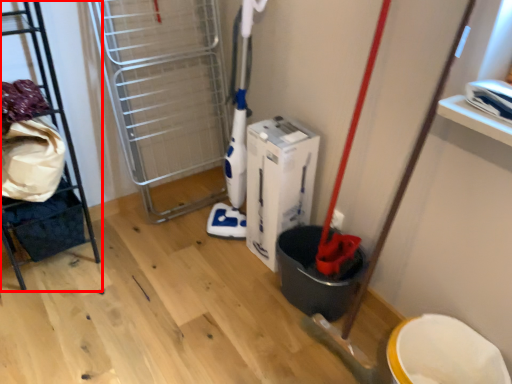
Question: From the image's perspective, considering the relative positions of furniture (annotated by the red box) and wide in the image provided, where is furniture (annotated by the red box) located with respect to the staircase?

Choices:
 (A) below
 (B) above

Answer: (B)